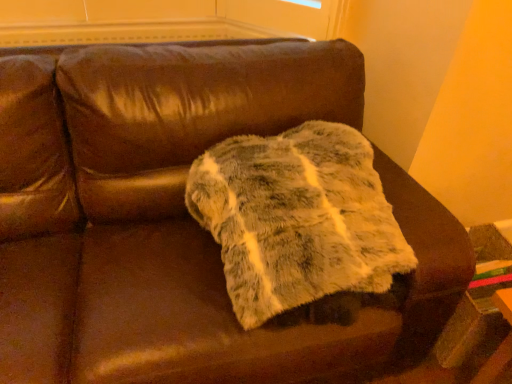
The width and height of the screenshot is (512, 384). Identify the location of fuzzy green-white blanket at center. (297, 218).

What is the approximate width of fuzzy green-white blanket at center?

fuzzy green-white blanket at center is 55.38 centimeters in width.

The image size is (512, 384). Describe the element at coordinates (297, 218) in the screenshot. I see `fuzzy green-white blanket at center` at that location.

This screenshot has height=384, width=512. What are the coordinates of `fuzzy green-white blanket at center` in the screenshot? It's located at (297, 218).